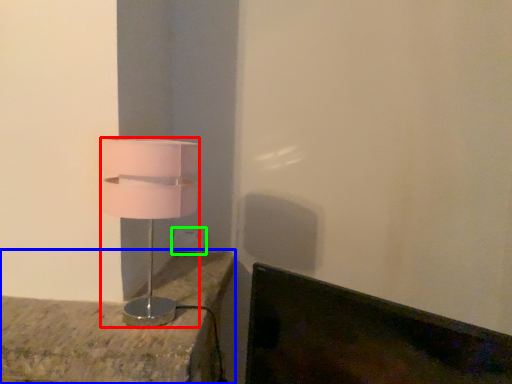
Question: Which is farther away from lamp (highlighted by a red box)? furniture (highlighted by a blue box) or electric outlet (highlighted by a green box)?

Choices:
 (A) furniture
 (B) electric outlet

Answer: (B)